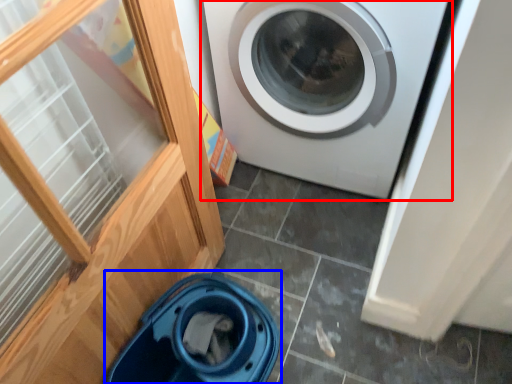
Question: Which object is closer to the camera taking this photo, washing machine (highlighted by a red box) or dish washer (highlighted by a blue box)?

Choices:
 (A) washing machine
 (B) dish washer

Answer: (B)